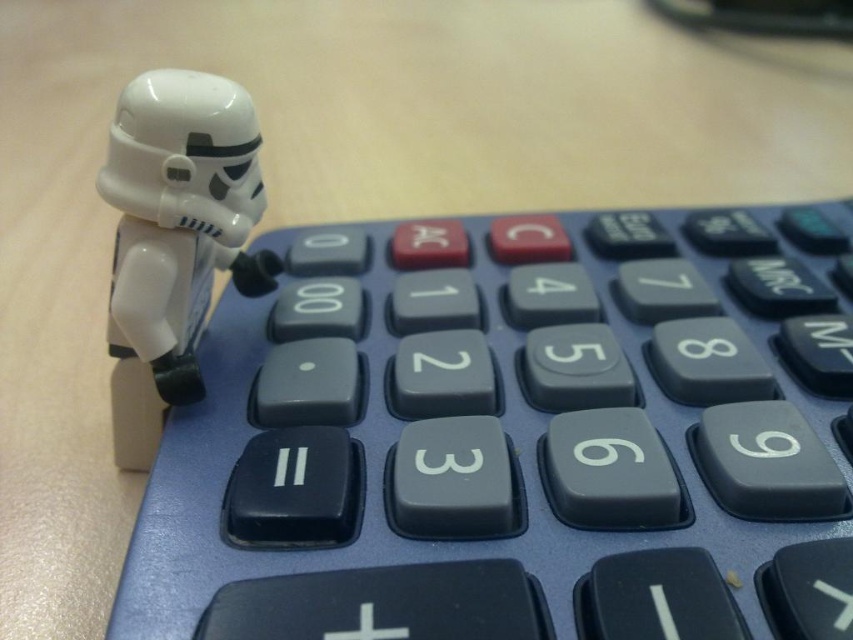
Question: Which point is farther to the camera?

Choices:
 (A) white glossy plastic stormtrooper at left
 (B) blue plastic calculator at upper left

Answer: (A)

Question: Is the position of blue plastic calculator at upper left less distant than that of white glossy plastic stormtrooper at left?

Choices:
 (A) no
 (B) yes

Answer: (B)

Question: Is the position of blue plastic calculator at upper left less distant than that of white glossy plastic stormtrooper at left?

Choices:
 (A) no
 (B) yes

Answer: (B)

Question: Can you confirm if blue plastic calculator at upper left is positioned below white glossy plastic stormtrooper at left?

Choices:
 (A) no
 (B) yes

Answer: (B)

Question: Which point is closer to the camera?

Choices:
 (A) (483, 243)
 (B) (157, 134)

Answer: (B)